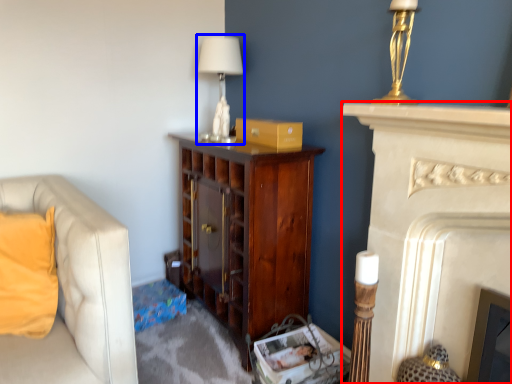
Question: Which object appears farthest to the camera in this image, fireplace (highlighted by a red box) or table lamp (highlighted by a blue box)?

Choices:
 (A) fireplace
 (B) table lamp

Answer: (B)